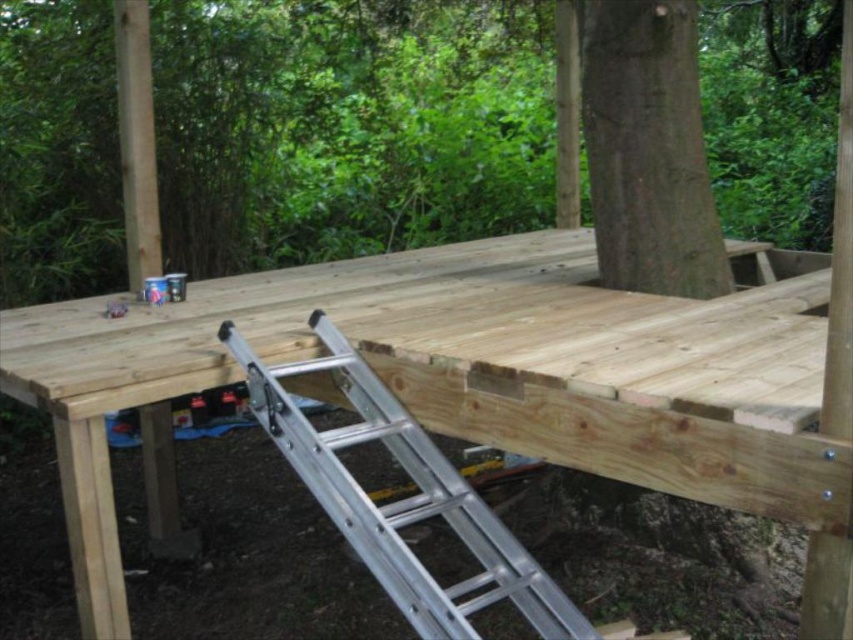
Between point (45, 300) and point (561, 627), which one is positioned behind?

The point (45, 300) is more distant.

Which of these two, brown wood tree at center or silver/aluminum ladder at lower center, stands shorter?

With less height is brown wood tree at center.

Is point (86, 260) positioned before point (375, 388)?

That is False.

Where is `brown wood tree at center`? The width and height of the screenshot is (853, 640). brown wood tree at center is located at coordinates (346, 125).

Is natural wood picnic table at center above silver/aluminum ladder at lower center?

Yes, natural wood picnic table at center is above silver/aluminum ladder at lower center.

What do you see at coordinates (462, 376) in the screenshot? Image resolution: width=853 pixels, height=640 pixels. I see `natural wood picnic table at center` at bounding box center [462, 376].

Locate an element on the screen. The image size is (853, 640). natural wood picnic table at center is located at coordinates coord(462,376).

Between natural wood picnic table at center and green rough bark tree at center, which one is positioned lower?

natural wood picnic table at center is lower down.

Locate an element on the screen. This screenshot has width=853, height=640. natural wood picnic table at center is located at coordinates (462, 376).

Find the location of `natural wood picnic table at center`. natural wood picnic table at center is located at coordinates (462, 376).